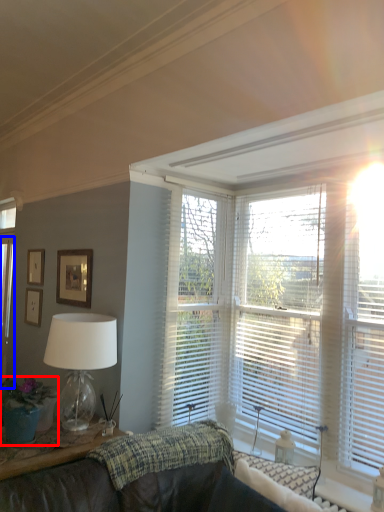
Question: Which point is further to the camera, houseplant (highlighted by a red box) or glass door (highlighted by a blue box)?

Choices:
 (A) houseplant
 (B) glass door

Answer: (B)